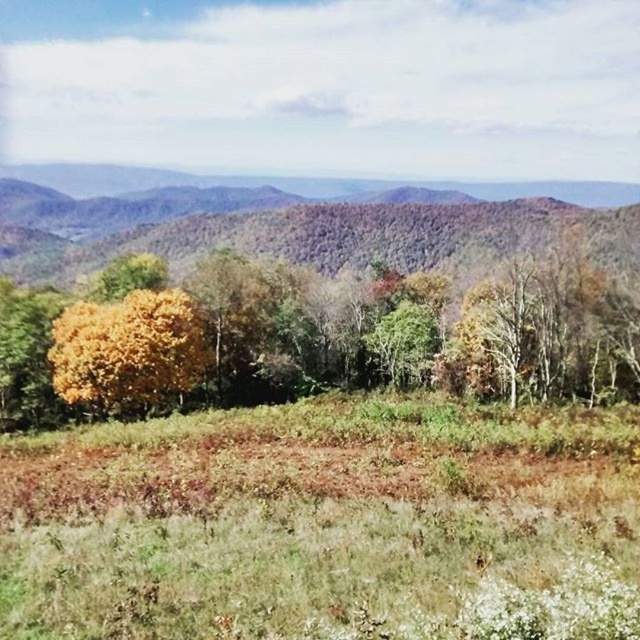
You are standing in the middle of the field of grass and wildflowers in the scene. You see two points marked in the image. Which point is closer to you, point (x=321, y=422) or point (x=96, y=353)?

Point (x=321, y=422) is in front of point (x=96, y=353), so it is closer to you.

You are standing in the middle of the field of grass and wildflowers in the foreground of the scene. You notice two points marked in the image. Which point is closer to you, point (80, 577) or point (376, 221)?

Point (80, 577) is closer to the camera than point (376, 221), so it is closer to you.